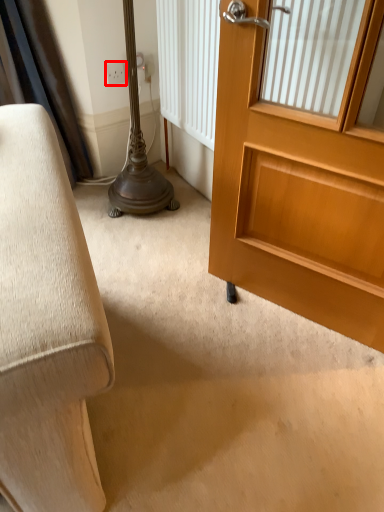
Question: From the image's perspective, considering the relative positions of electric outlet (annotated by the red box) and door in the image provided, where is electric outlet (annotated by the red box) located with respect to the staircase?

Choices:
 (A) below
 (B) above

Answer: (B)